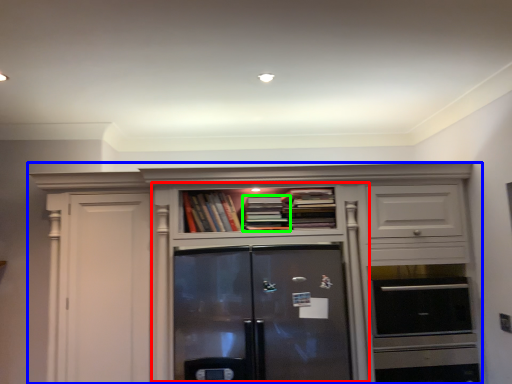
Question: Based on their relative distances, which object is farther from cupboard (highlighted by a red box)? Choose from cabinetry (highlighted by a blue box) and book (highlighted by a green box).

Choices:
 (A) cabinetry
 (B) book

Answer: (B)